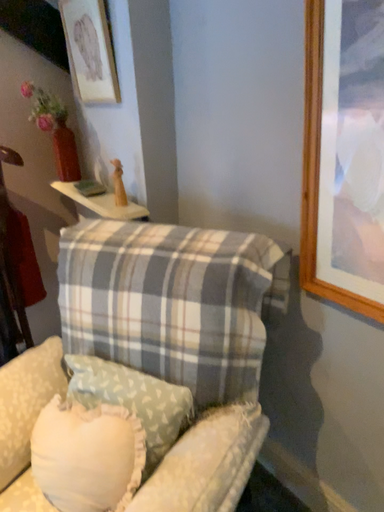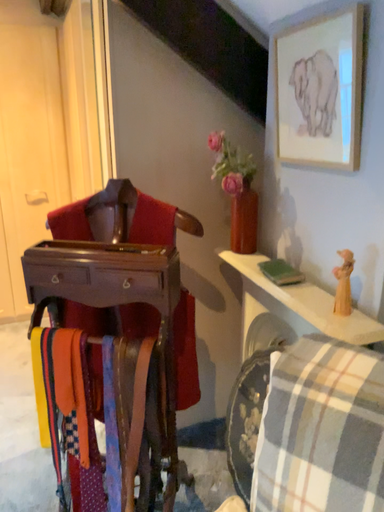
Question: Which way did the camera rotate in the video?

Choices:
 (A) rotated right
 (B) rotated left

Answer: (B)